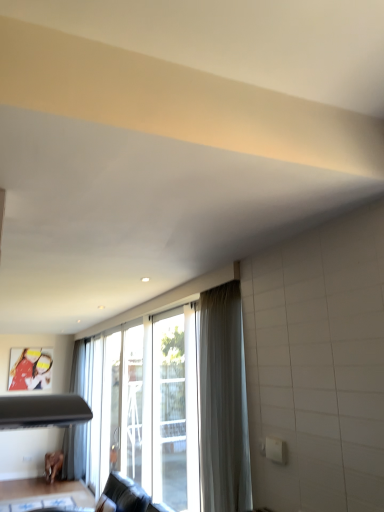
Question: Is white sheer curtain at center bigger than brown wooden table at lower left?

Choices:
 (A) no
 (B) yes

Answer: (B)

Question: From a real-world perspective, is white sheer curtain at center under brown wooden table at lower left?

Choices:
 (A) no
 (B) yes

Answer: (A)

Question: Is white sheer curtain at center aimed at brown wooden table at lower left?

Choices:
 (A) yes
 (B) no

Answer: (B)

Question: Does white sheer curtain at center appear on the left side of brown wooden table at lower left?

Choices:
 (A) yes
 (B) no

Answer: (B)

Question: From the image's perspective, is white sheer curtain at center located beneath brown wooden table at lower left?

Choices:
 (A) no
 (B) yes

Answer: (A)

Question: Is brown wooden table at lower left bigger or smaller than transparent glass screen door at center, the first screen door when ordered from right to left?

Choices:
 (A) small
 (B) big

Answer: (A)

Question: Considering the positions of brown wooden table at lower left and transparent glass screen door at center, marked as the second screen door in a back-to-front arrangement, in the image, is brown wooden table at lower left wider or thinner than transparent glass screen door at center, marked as the second screen door in a back-to-front arrangement,?

Choices:
 (A) thin
 (B) wide

Answer: (B)

Question: In the image, is brown wooden table at lower left on the left side or the right side of transparent glass screen door at center, the first screen door when ordered from right to left?

Choices:
 (A) right
 (B) left

Answer: (B)

Question: From the image's perspective, is brown wooden table at lower left located above or below transparent glass screen door at center, the 1th screen door viewed from the front?

Choices:
 (A) below
 (B) above

Answer: (A)

Question: Considering the positions of point (102, 394) and point (152, 392), is point (102, 394) closer or farther from the camera than point (152, 392)?

Choices:
 (A) closer
 (B) farther

Answer: (B)

Question: From the image's perspective, relative to transparent glass screen door at center, marked as the second screen door in a back-to-front arrangement, is clear glass screen door at center, arranged as the 2th screen door when viewed from the front, above or below?

Choices:
 (A) below
 (B) above

Answer: (A)

Question: From a real-world perspective, is clear glass screen door at center, arranged as the 2th screen door when viewed from the front, positioned above or below transparent glass screen door at center, arranged as the second screen door when viewed from the left?

Choices:
 (A) below
 (B) above

Answer: (A)

Question: Choose the correct answer: Is clear glass screen door at center, marked as the 1th screen door in a back-to-front arrangement, inside transparent glass screen door at center, the first screen door when ordered from right to left, or outside it?

Choices:
 (A) outside
 (B) inside

Answer: (A)

Question: From the image's perspective, relative to brown wooden table at lower left, is clear glass screen door at center, which is the first screen door in left-to-right order, above or below?

Choices:
 (A) above
 (B) below

Answer: (A)

Question: Visually, is clear glass screen door at center, arranged as the 2th screen door when viewed from the front, positioned to the left or to the right of brown wooden table at lower left?

Choices:
 (A) right
 (B) left

Answer: (A)